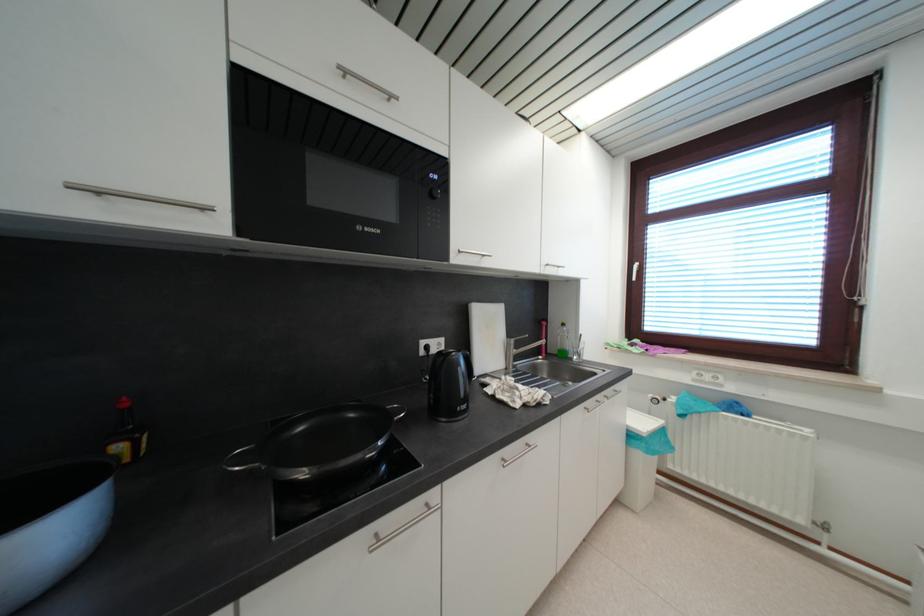
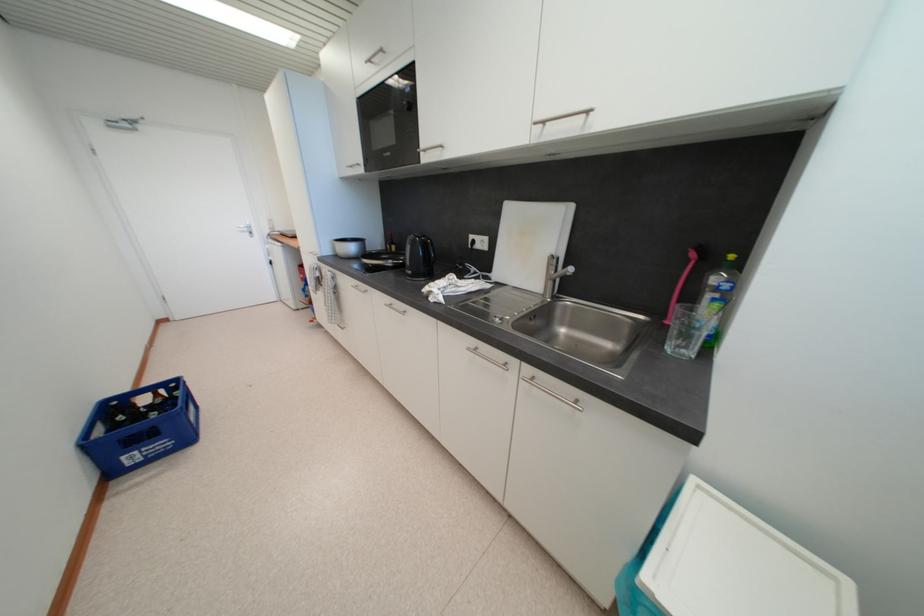
In the second image, find the point that corresponds to the point at 349,75 in the first image.

(375, 63)